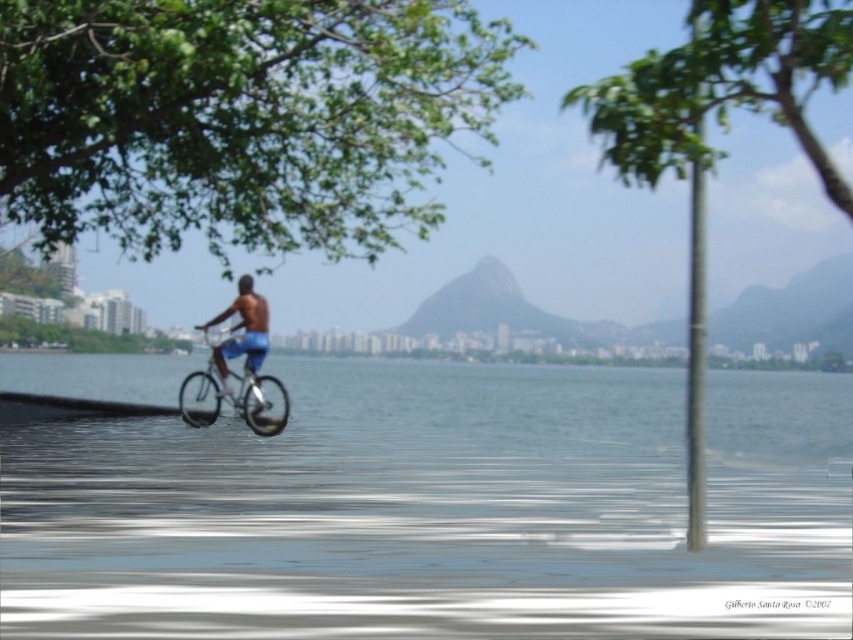
Question: Which point is closer to the camera?

Choices:
 (A) green leafy tree at upper right
 (B) green leafy tree at upper center
 (C) green leafy tree at upper left

Answer: (A)

Question: Does clear water at center have a larger size compared to green leafy tree at upper left?

Choices:
 (A) yes
 (B) no

Answer: (A)

Question: Which object is the farthest from the blue fabric shorts at center?

Choices:
 (A) green leafy tree at upper left
 (B) green leafy tree at upper right

Answer: (B)

Question: Observing the image, what is the correct spatial positioning of green leafy tree at upper center in reference to blue fabric shorts at center?

Choices:
 (A) above
 (B) below

Answer: (A)

Question: Can you confirm if clear water at center is thinner than shiny blue shorts at center?

Choices:
 (A) yes
 (B) no

Answer: (B)

Question: Estimate the real-world distances between objects in this image. Which object is farther from the clear water at center?

Choices:
 (A) shiny blue shorts at center
 (B) green leafy tree at upper left
 (C) blue fabric shorts at center

Answer: (B)